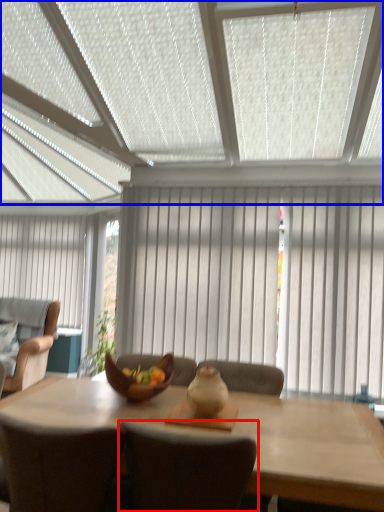
Question: Among these objects, which one is farthest to the camera, chair (highlighted by a red box) or window blind (highlighted by a blue box)?

Choices:
 (A) chair
 (B) window blind

Answer: (A)